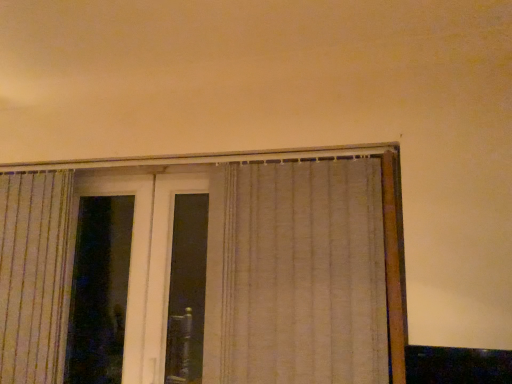
Question: Is point (293, 329) closer or farther from the camera than point (195, 182)?

Choices:
 (A) farther
 (B) closer

Answer: (B)

Question: Is beige textured curtain at center to the left or to the right of transparent glass screen door at left in the image?

Choices:
 (A) left
 (B) right

Answer: (B)

Question: Considering their positions, is beige textured curtain at center located in front of or behind transparent glass screen door at left?

Choices:
 (A) behind
 (B) front

Answer: (B)

Question: From a real-world perspective, relative to beige textured curtain at center, is transparent glass screen door at left vertically above or below?

Choices:
 (A) above
 (B) below

Answer: (B)

Question: In the image, is transparent glass screen door at left on the left side or the right side of beige textured curtain at center?

Choices:
 (A) right
 (B) left

Answer: (B)

Question: Is transparent glass screen door at left wider or thinner than beige textured curtain at center?

Choices:
 (A) wide
 (B) thin

Answer: (B)

Question: Considering the positions of transparent glass screen door at left and beige textured curtain at center in the image, is transparent glass screen door at left taller or shorter than beige textured curtain at center?

Choices:
 (A) short
 (B) tall

Answer: (B)